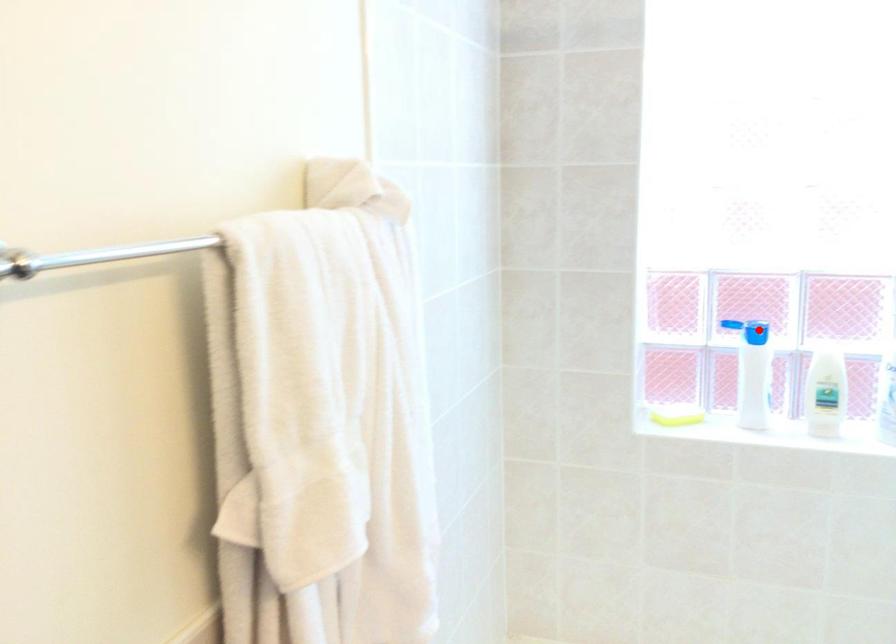
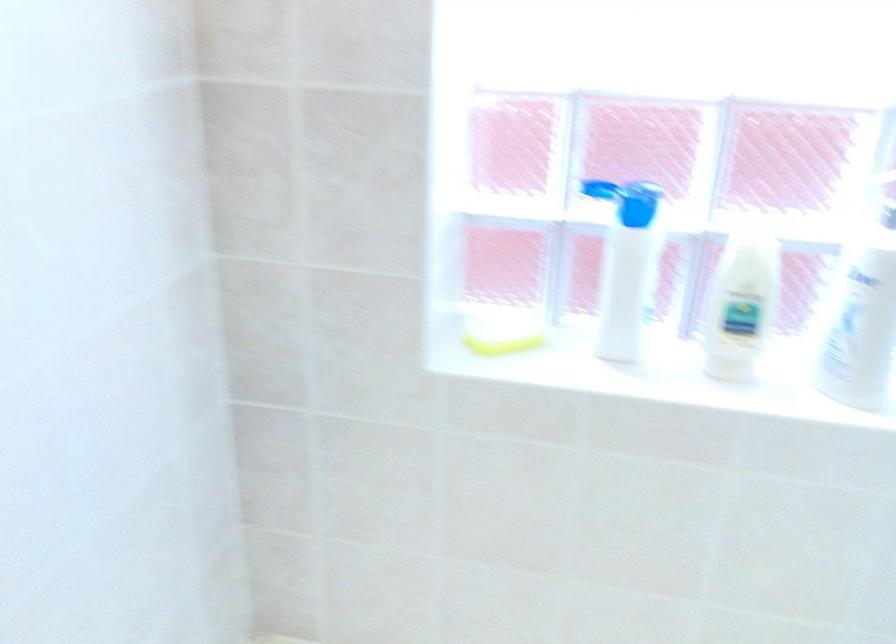
Question: I am providing you with two images of the same scene from different viewpoints. A red point is shown in image1. For the corresponding object point in image2, is it positioned nearer or farther from the camera?

Choices:
 (A) Nearer
 (B) Farther

Answer: (A)